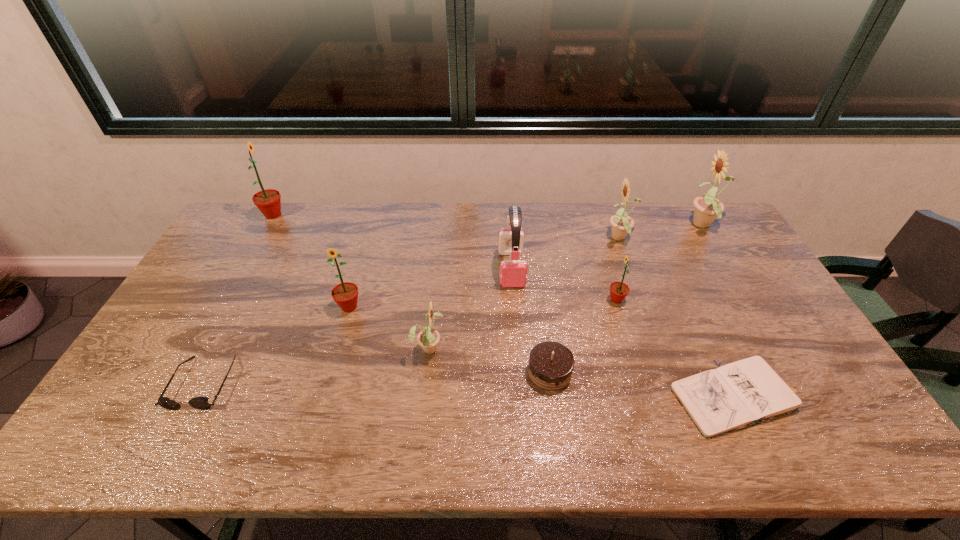
At what (x,y) coordinates should I click in order to perform the action: click on the leftmost yellow sunflower. Please return your answer as a coordinate pair (x, y). This screenshot has width=960, height=540. Looking at the image, I should click on (428, 338).

This screenshot has width=960, height=540. In order to click on the rightmost green sunflower in this screenshot , I will do `click(618, 290)`.

At what (x,y) coordinates should I click in order to perform the action: click on the third shortest object. Please return your answer as a coordinate pair (x, y). This screenshot has height=540, width=960. Looking at the image, I should click on (551, 364).

Locate an element on the screen. This screenshot has height=540, width=960. chocolate cake is located at coordinates (551, 364).

Where is `the ninth tallest object`? The image size is (960, 540). the ninth tallest object is located at coordinates (201, 403).

I want to click on the shortest object, so click(x=746, y=392).

You are a GUI agent. You are given a task and a screenshot of the screen. Output one action in this format:
    pyautogui.click(x=<x>, y=<y>)
    Task: Click on the vacant area located 0.200m on the front-facing side of the rightmost yellow sunflower
    
    Given the screenshot: What is the action you would take?
    pyautogui.click(x=630, y=226)

This screenshot has height=540, width=960. I want to click on vacant position located 0.200m on the front-facing side of the rightmost yellow sunflower, so 630,226.

Where is `vacant space located on the front-facing side of the rightmost yellow sunflower`? vacant space located on the front-facing side of the rightmost yellow sunflower is located at coordinates (627, 226).

Locate an element on the screen. free region located 0.150m on the face of the leftmost sunflower is located at coordinates (325, 215).